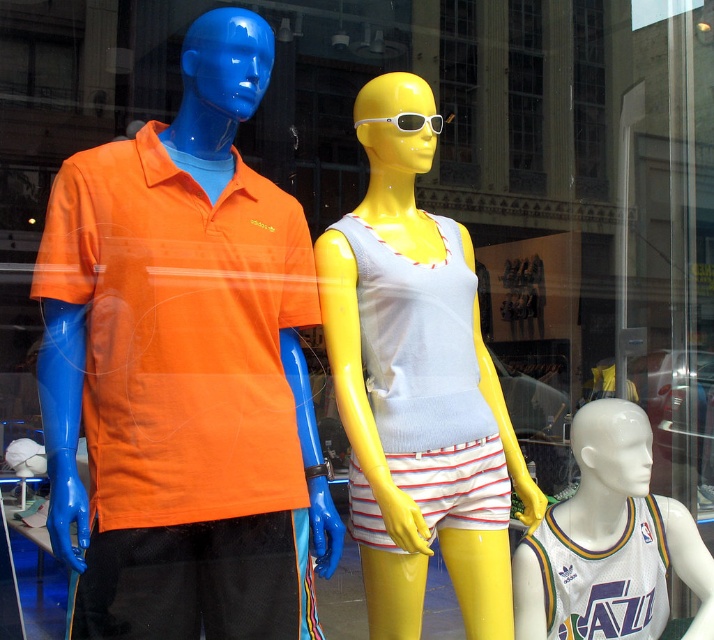
Between matte yellow mannequin at center and white jersey at lower right, which one is positioned lower?

Positioned lower is white jersey at lower right.

Is point (376, 179) positioned in front of point (688, 531)?

Yes.

The image size is (714, 640). Find the location of `matte yellow mannequin at center`. matte yellow mannequin at center is located at coordinates (377, 374).

Can you confirm if matte orange polo shirt at left is bigger than white plastic sunglasses at center?

Correct, matte orange polo shirt at left is larger in size than white plastic sunglasses at center.

Is matte orange polo shirt at left wider than white plastic sunglasses at center?

Indeed, matte orange polo shirt at left has a greater width compared to white plastic sunglasses at center.

From the picture: Measure the distance between matte orange polo shirt at left and camera.

The distance of matte orange polo shirt at left from camera is 4.21 feet.

Find the location of a particular element. The image size is (714, 640). matte orange polo shirt at left is located at coordinates (181, 369).

Measure the distance between matte yellow mannequin at center and camera.

4.91 feet

Between matte yellow mannequin at center and white plastic sunglasses at center, which one appears on the right side from the viewer's perspective?

Positioned to the right is matte yellow mannequin at center.

Locate an element on the screen. This screenshot has width=714, height=640. matte yellow mannequin at center is located at coordinates (377, 374).